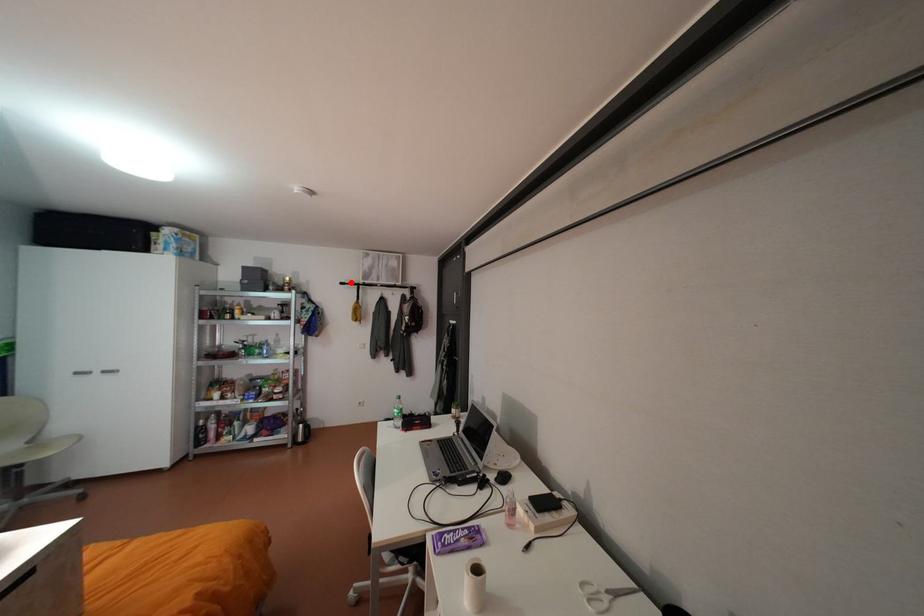
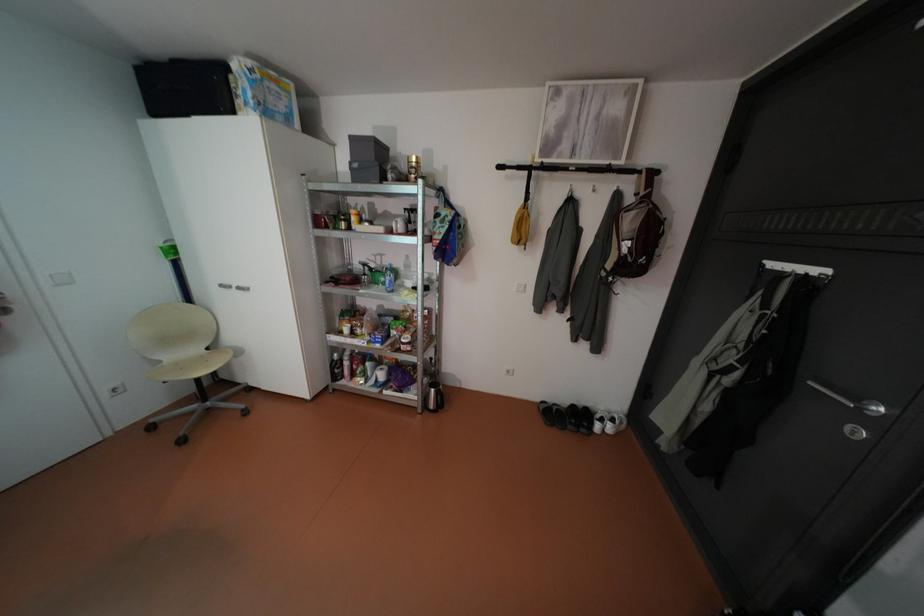
Question: I am providing you with two images of the same scene from different viewpoints. A red point is marked on the first image. Can you still see the location of the red point in image 2?

Choices:
 (A) Yes
 (B) No

Answer: (A)